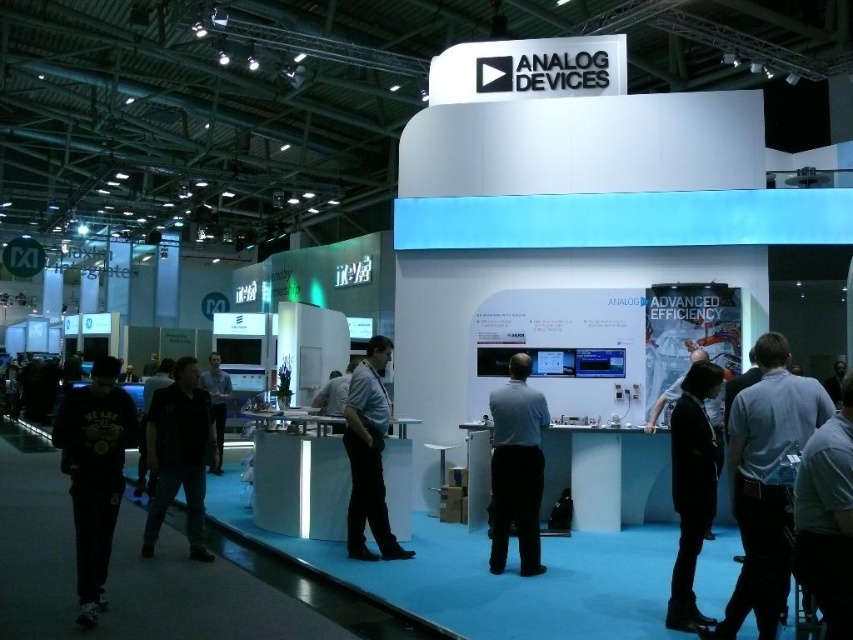
Question: Among these objects, which one is farthest from the camera?

Choices:
 (A) dark gray fabric chair at lower right
 (B) dark gray shirt at center
 (C) black matte sweatshirt at left
 (D) black cotton shirt at left

Answer: (B)

Question: Is gray fabric shirt at right above black shirt at center?

Choices:
 (A) yes
 (B) no

Answer: (A)

Question: Based on their relative distances, which object is farther from the black shirt at center?

Choices:
 (A) dark gray shirt at center
 (B) dark gray fabric chair at lower right

Answer: (A)

Question: Does gray fabric shirt at center appear under black leather jacket at lower right?

Choices:
 (A) yes
 (B) no

Answer: (A)

Question: Where is gray fabric shirt at center located in relation to black shirt at center in the image?

Choices:
 (A) above
 (B) below

Answer: (B)

Question: Which of the following is the farthest from the observer?

Choices:
 (A) gray fabric shirt at center
 (B) black matte sweatshirt at left
 (C) black leather jacket at lower right
 (D) dark gray shirt at center

Answer: (D)